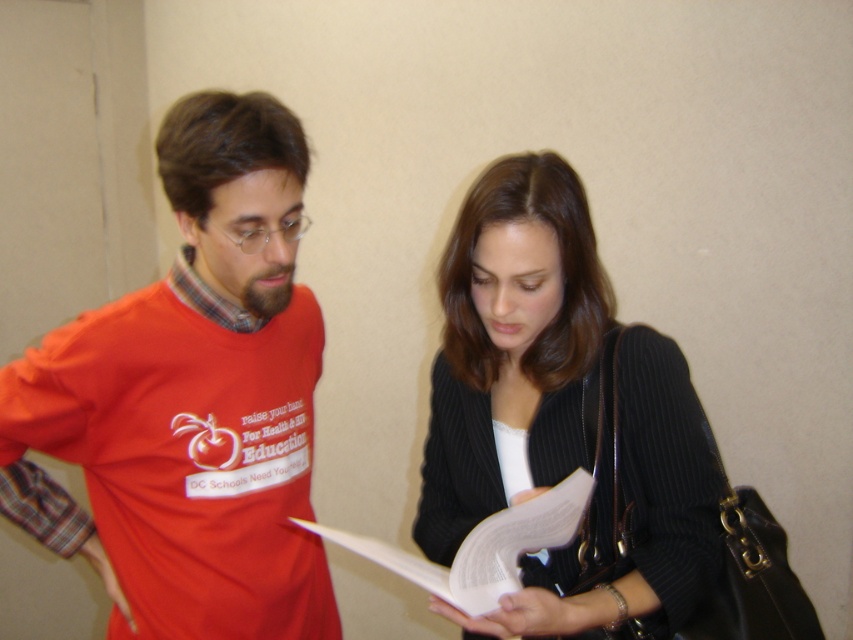
You are a photographer standing at the location of the viewer. You need to take a photo of the black ribbed sweater at center without moving the sweater. What is the minimum distance you must move forward to ensure the sweater fills the frame?

The black ribbed sweater at center is 98.20 centimeters away from the viewer. To ensure the sweater fills the frame, you must move forward until the distance is reduced to the minimum required by your camera lens. However, without specific lens details, the exact distance cannot be calculated, but moving closer than 98.20 cm would decrease the distance.

You are a photographer who wants to take a picture of the black ribbed sweater at center and the white paper at center. To ensure both are in focus, you need to know their positions relative to each other. Which object is on the left side?

The white paper at center is on the left side since the black ribbed sweater at center is to the right of it.